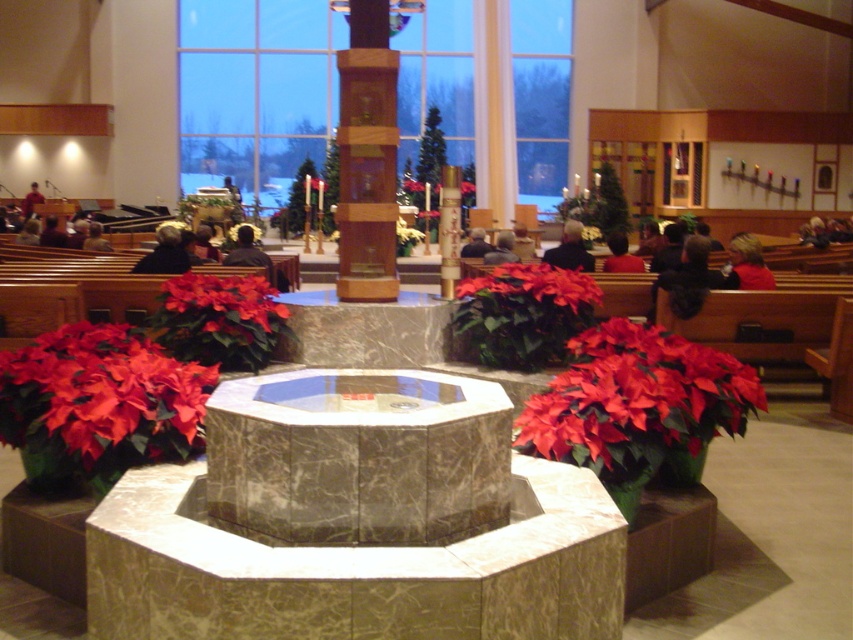
Question: In this image, where is wooden pillar at center located relative to red matte poinsettia at center?

Choices:
 (A) left
 (B) right

Answer: (A)

Question: Which object appears closest to the camera in this image?

Choices:
 (A) red matte poinsettia at center
 (B) matte red poinsettia at lower right
 (C) wooden pillar at center
 (D) matte red poinsettia at center

Answer: (B)

Question: Estimate the real-world distances between objects in this image. Which object is closer to the matte red poinsettia at center?

Choices:
 (A) wooden pillar at center
 (B) matte red poinsettia at lower right
 (C) red matte poinsettia at center

Answer: (A)

Question: Does matte red poinsettia at center come in front of red matte poinsettia at center?

Choices:
 (A) no
 (B) yes

Answer: (B)

Question: Does wooden pillar at center appear on the left side of red matte poinsettia at center?

Choices:
 (A) no
 (B) yes

Answer: (B)

Question: Which object appears closest to the camera in this image?

Choices:
 (A) matte red poinsettia at center
 (B) matte red poinsettia at lower left
 (C) matte red poinsettia at lower right

Answer: (B)